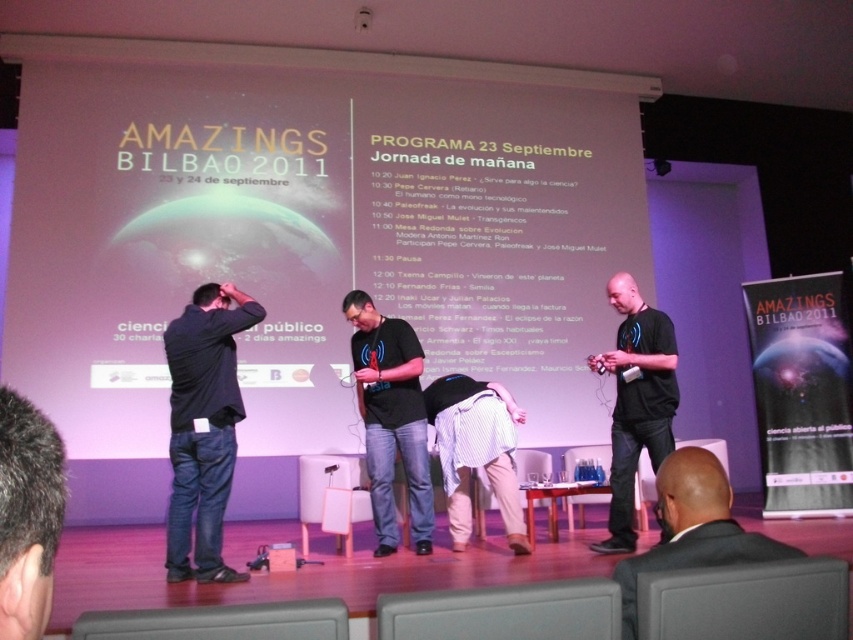
In the scene shown: Does black matte shirt at left come behind black matte shirt at center?

No, it is in front of black matte shirt at center.

Between point (192, 461) and point (672, 400), which one is positioned in front?

Point (192, 461)

Locate an element on the screen. black matte shirt at left is located at coordinates pyautogui.click(x=202, y=426).

Which is above, black matte shirt at left or black cotton t-shirt at center?

black matte shirt at left is above.

Which is in front, point (209, 524) or point (364, 333)?

Point (209, 524) is in front.

Where is `black matte shirt at left`? Image resolution: width=853 pixels, height=640 pixels. black matte shirt at left is located at coordinates (202, 426).

Does point (618, 356) lie behind point (490, 426)?

No, (618, 356) is in front of (490, 426).

Where is `black matte shirt at center`? This screenshot has width=853, height=640. black matte shirt at center is located at coordinates (636, 401).

Is point (643, 330) farther from viewer compared to point (514, 493)?

No.

In order to click on black matte shirt at center in this screenshot , I will do `click(636, 401)`.